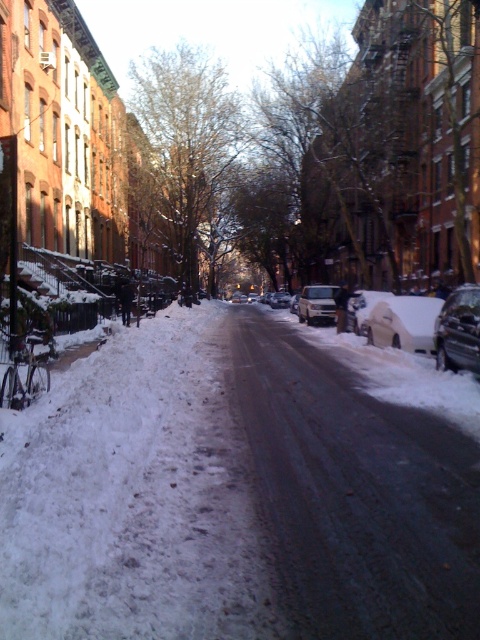
Between point (407, 340) and point (320, 301), which one is positioned in front?

Point (407, 340) is more forward.

What do you see at coordinates (404, 323) in the screenshot? I see `white matte car at right` at bounding box center [404, 323].

Find the location of a particular element. The width and height of the screenshot is (480, 640). white matte car at right is located at coordinates 404,323.

Is white matte car at right below silver metallic van at center?

Correct, white matte car at right is located below silver metallic van at center.

Who is more forward, (388, 339) or (277, 300)?

Point (388, 339) is more forward.

Locate an element on the screen. white matte car at right is located at coordinates (404, 323).

Who is positioned more to the left, satin silver sedan at center or silver metallic van at center?

From the viewer's perspective, silver metallic van at center appears more on the left side.

Who is more forward, (336,292) or (272,307)?

Point (336,292) is in front.

The image size is (480, 640). What are the coordinates of `satin silver sedan at center` in the screenshot? It's located at (316, 305).